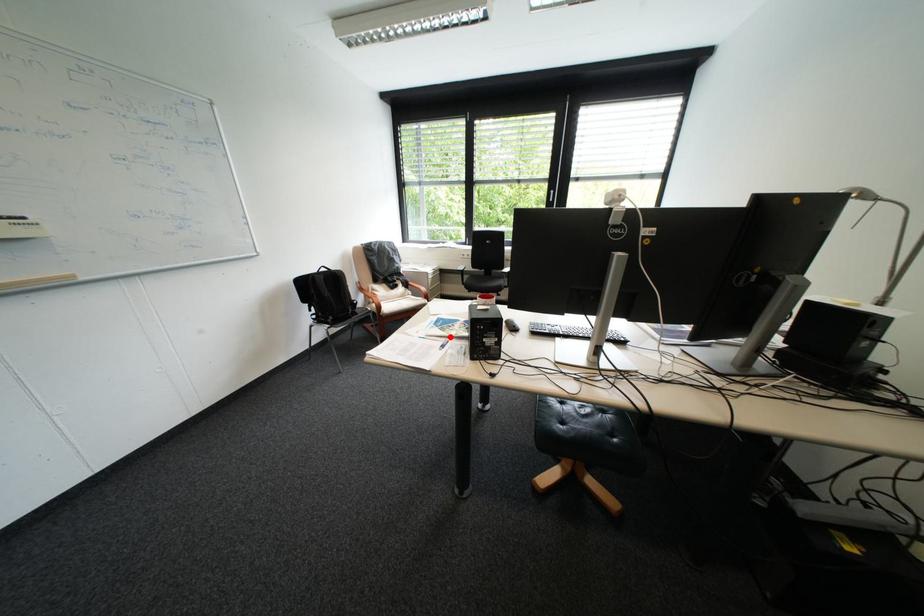
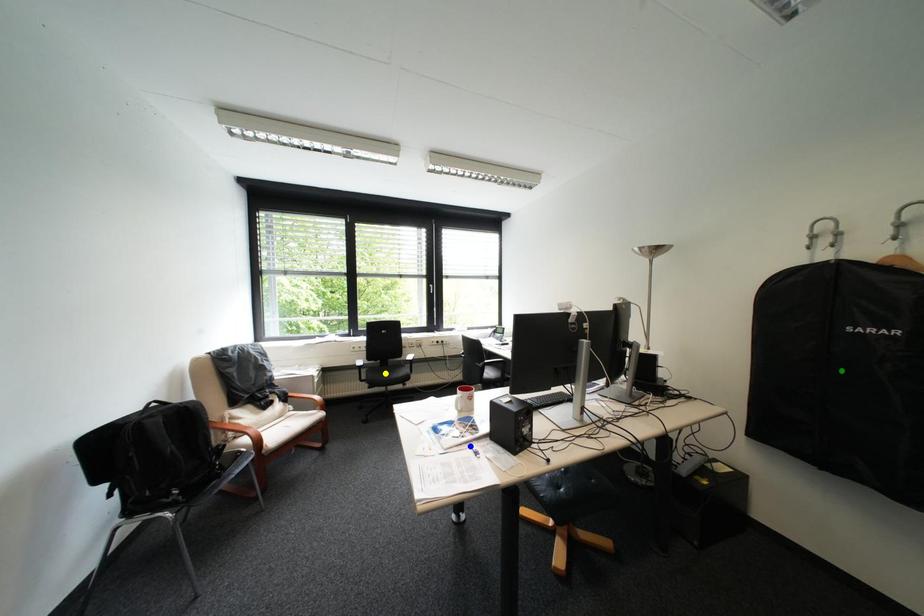
Question: I am providing you with two images of the same scene from different viewpoints. A red point is marked on the first image. You are given multiple points on the second image. Which point in image 2 represents the same 3d spot as the red point in image 1?

Choices:
 (A) green point
 (B) blue point
 (C) yellow point

Answer: (B)